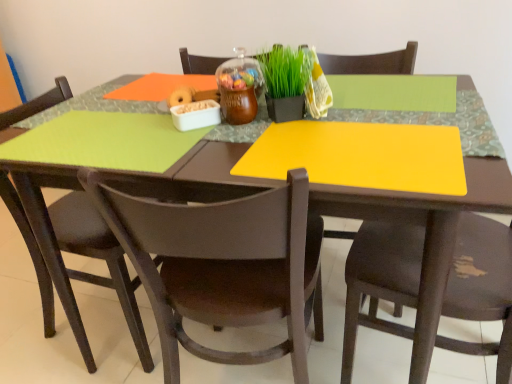
Question: Is brown plastic chair at center, the 2th chair viewed from the left, completely or partially outside of matte brown chair at lower right, placed as the 1th chair when sorted from right to left?

Choices:
 (A) no
 (B) yes

Answer: (B)

Question: Considering the relative positions of brown plastic chair at center, placed as the 2th chair when sorted from right to left, and matte brown chair at lower right, placed as the 1th chair when sorted from right to left, in the image provided, is brown plastic chair at center, placed as the 2th chair when sorted from right to left, to the left of matte brown chair at lower right, placed as the 1th chair when sorted from right to left, from the viewer's perspective?

Choices:
 (A) no
 (B) yes

Answer: (B)

Question: Does brown plastic chair at center, placed as the 2th chair when sorted from right to left, contain matte brown chair at lower right, placed as the 1th chair when sorted from right to left?

Choices:
 (A) no
 (B) yes

Answer: (A)

Question: Is brown plastic chair at center, the 2th chair viewed from the left, at the right side of matte brown chair at lower right, placed as the 1th chair when sorted from right to left?

Choices:
 (A) yes
 (B) no

Answer: (B)

Question: Is brown plastic chair at center, placed as the 2th chair when sorted from right to left, further to the viewer compared to matte brown chair at lower right, the 3th chair in the left-to-right sequence?

Choices:
 (A) no
 (B) yes

Answer: (B)

Question: From the image's perspective, is matte brown chair at lower right, the 3th chair in the left-to-right sequence, located above or below green matte plant at center?

Choices:
 (A) below
 (B) above

Answer: (A)

Question: Is matte brown chair at lower right, the 3th chair in the left-to-right sequence, in front of or behind green matte plant at center in the image?

Choices:
 (A) behind
 (B) front

Answer: (B)

Question: Looking at the image, does matte brown chair at lower right, placed as the 1th chair when sorted from right to left, seem bigger or smaller compared to green matte plant at center?

Choices:
 (A) big
 (B) small

Answer: (A)

Question: Considering the positions of matte brown chair at lower right, the 3th chair in the left-to-right sequence, and green matte plant at center in the image, is matte brown chair at lower right, the 3th chair in the left-to-right sequence, taller or shorter than green matte plant at center?

Choices:
 (A) tall
 (B) short

Answer: (A)

Question: Is brown plastic chair at center, placed as the 2th chair when sorted from right to left, inside or outside of matte brown chair at lower left, placed as the 1th chair when sorted from left to right?

Choices:
 (A) outside
 (B) inside

Answer: (A)

Question: Based on their sizes in the image, would you say brown plastic chair at center, placed as the 2th chair when sorted from right to left, is bigger or smaller than matte brown chair at lower left, which is the 3th chair from right to left?

Choices:
 (A) big
 (B) small

Answer: (A)

Question: Visually, is brown plastic chair at center, placed as the 2th chair when sorted from right to left, positioned to the left or to the right of matte brown chair at lower left, placed as the 1th chair when sorted from left to right?

Choices:
 (A) left
 (B) right

Answer: (B)

Question: Is point (265, 317) closer or farther from the camera than point (117, 286)?

Choices:
 (A) farther
 (B) closer

Answer: (B)

Question: Is brown plastic chair at center, the 2th chair viewed from the left, bigger or smaller than matte brown chair at lower right, the 3th chair in the left-to-right sequence?

Choices:
 (A) small
 (B) big

Answer: (A)

Question: Based on their positions, is brown plastic chair at center, placed as the 2th chair when sorted from right to left, located to the left or right of matte brown chair at lower right, placed as the 1th chair when sorted from right to left?

Choices:
 (A) left
 (B) right

Answer: (A)